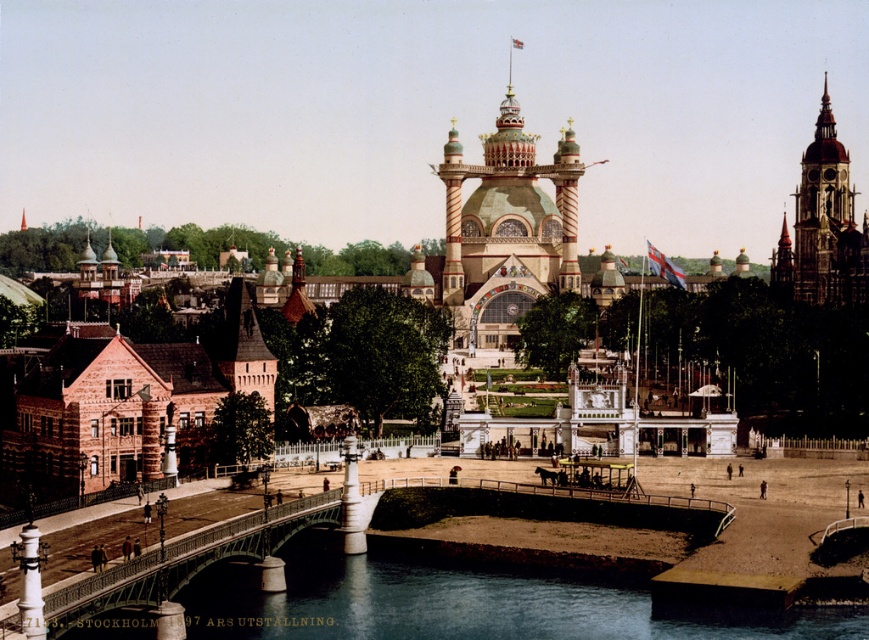
Question: Where is green wrought iron bridge at lower left located in relation to golden stone clock tower at upper right in the image?

Choices:
 (A) below
 (B) above

Answer: (A)

Question: From the image, what is the correct spatial relationship of green textured dome at center in relation to green wrought iron bridge at lower left?

Choices:
 (A) above
 (B) below

Answer: (A)

Question: Which point appears closest to the camera in this image?

Choices:
 (A) (362, 616)
 (B) (282, 512)
 (C) (453, 275)
 (D) (834, 200)

Answer: (A)

Question: Among these objects, which one is nearest to the camera?

Choices:
 (A) golden stone clock tower at upper right
 (B) green textured dome at center
 (C) smooth concrete river at lower left

Answer: (C)

Question: Which point is farther from the camera taking this photo?

Choices:
 (A) (141, 588)
 (B) (386, 563)
 (C) (827, 96)
 (D) (545, 273)

Answer: (C)

Question: Is green wrought iron bridge at lower left bigger than golden stone clock tower at upper right?

Choices:
 (A) no
 (B) yes

Answer: (A)